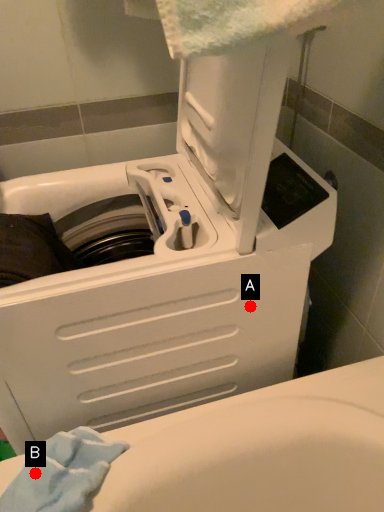
Question: Two points are circled on the image, labeled by A and B beside each circle. Which point is closer to the camera?

Choices:
 (A) A is closer
 (B) B is closer

Answer: (B)